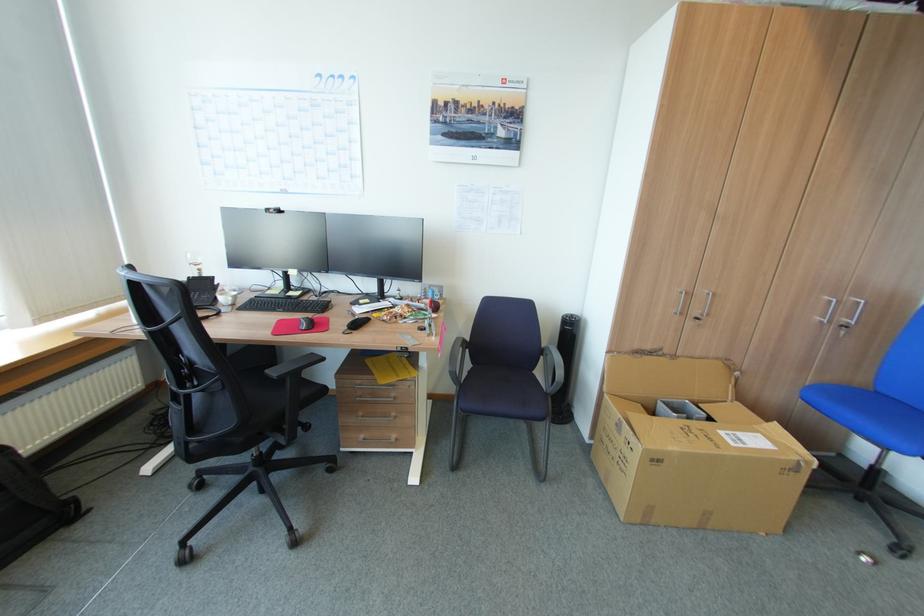
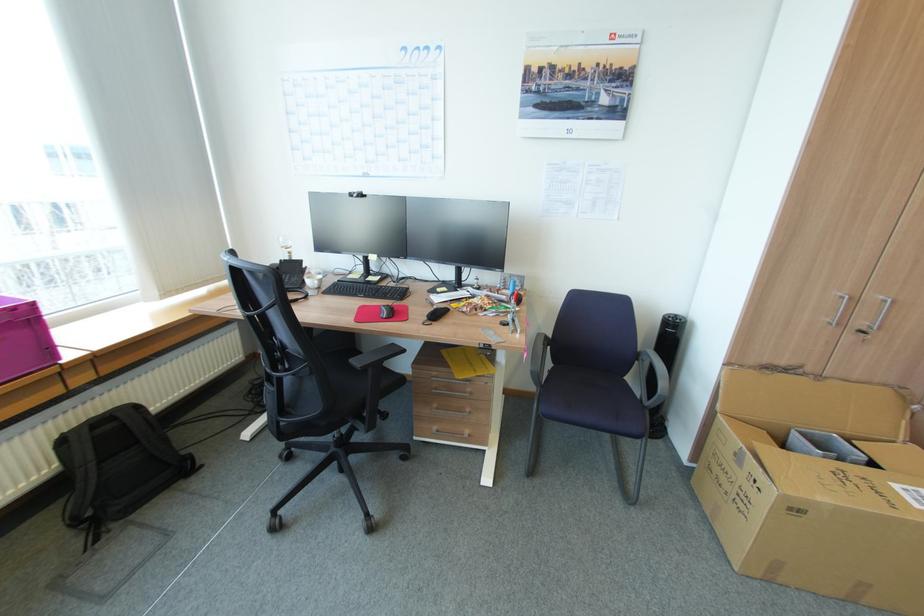
The point at (318, 353) is marked in the first image. Where is the corresponding point in the second image?

(397, 342)